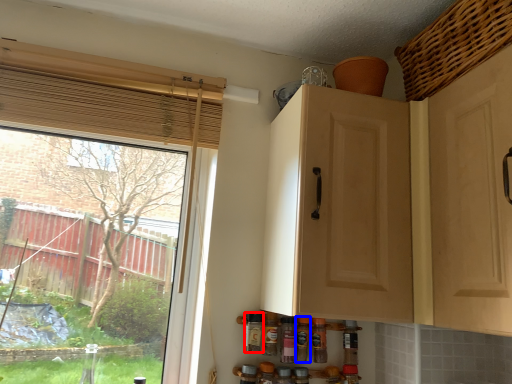
Question: Among these objects, which one is nearest to the camera, bottle (highlighted by a red box) or bottle (highlighted by a blue box)?

Choices:
 (A) bottle
 (B) bottle

Answer: (A)